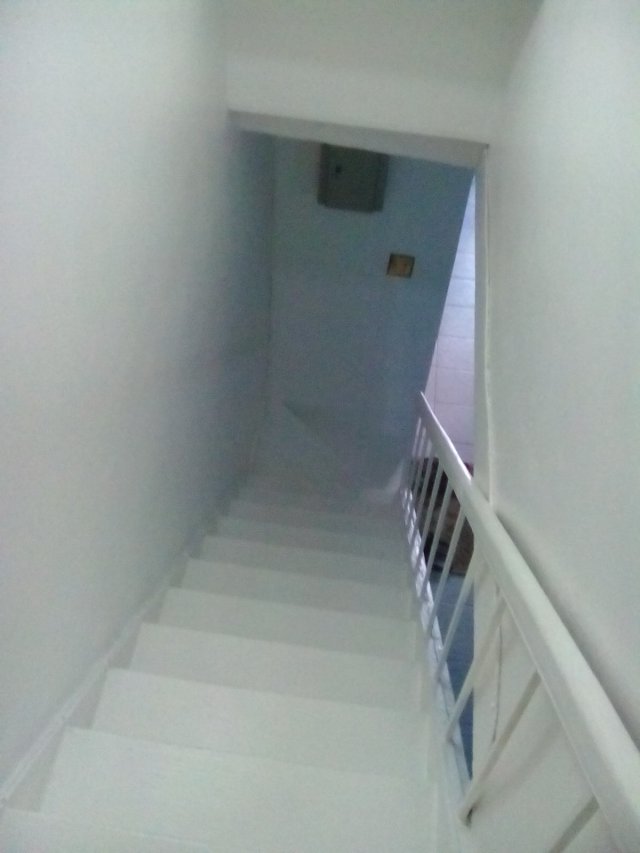
Identify the location of light switch. The image size is (640, 853). coord(402,265).